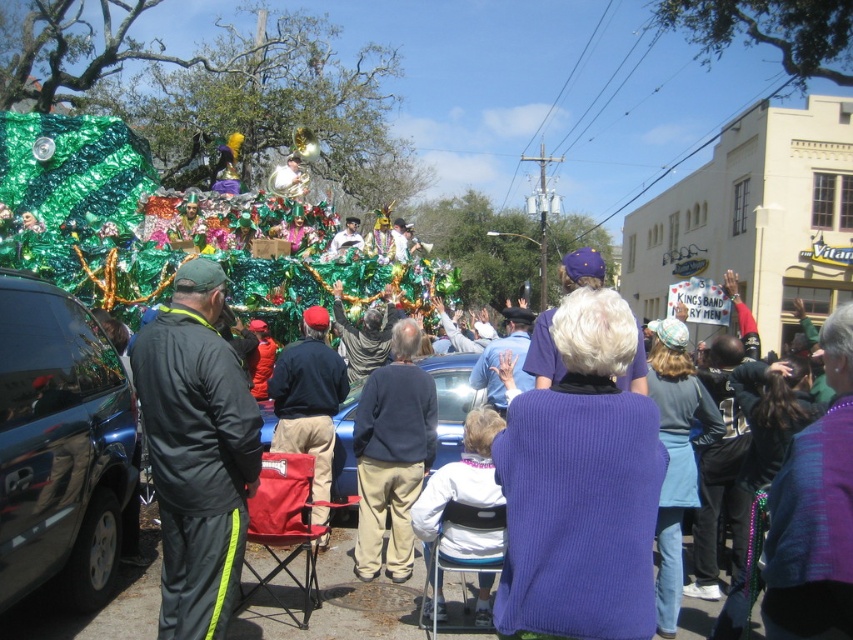
You are standing in the crowd watching the parade float. There are two points marked on the float, one at coordinates point (195, 401) and another at point (485, 304). Which point would appear closer to you as you look at the float?

Point (195, 401) is closer to the camera than point (485, 304), so the point at coordinates point (195, 401) would appear closer to you as you look at the float.